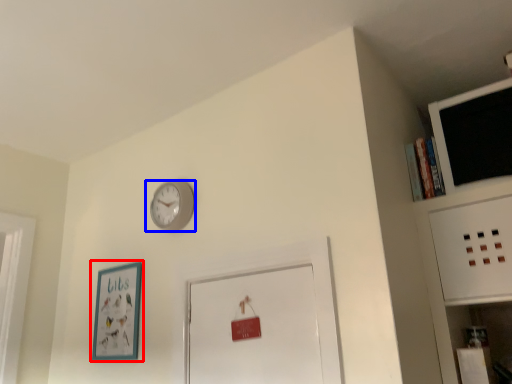
Question: Which object is further to the camera taking this photo, picture frame (highlighted by a red box) or wall clock (highlighted by a blue box)?

Choices:
 (A) picture frame
 (B) wall clock

Answer: (A)